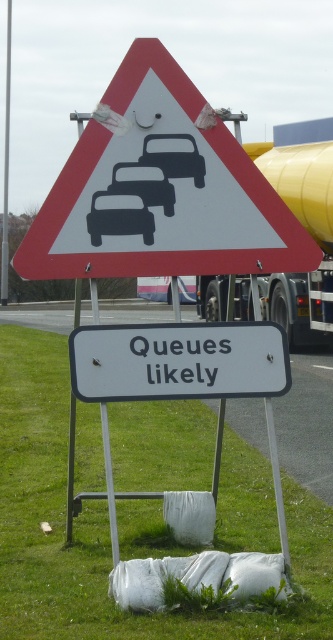
You are a delivery driver who needs to pass through this area. You see a white plastic signboard at center and a yellow rubber trailer truck at upper right. Which object is narrower in width?

The white plastic signboard at center is thinner than the yellow rubber trailer truck at upper right, so the white plastic signboard at center is narrower in width.

You are a pedestrian trying to read the signs mounted on the metal frame. Which object, the white plastic triangle at center or the black glossy car at center, would you see first as you approach the signs?

The white plastic triangle at center is closer to the viewer than the black glossy car at center, so you would see the white plastic triangle at center first as you approach the signs.